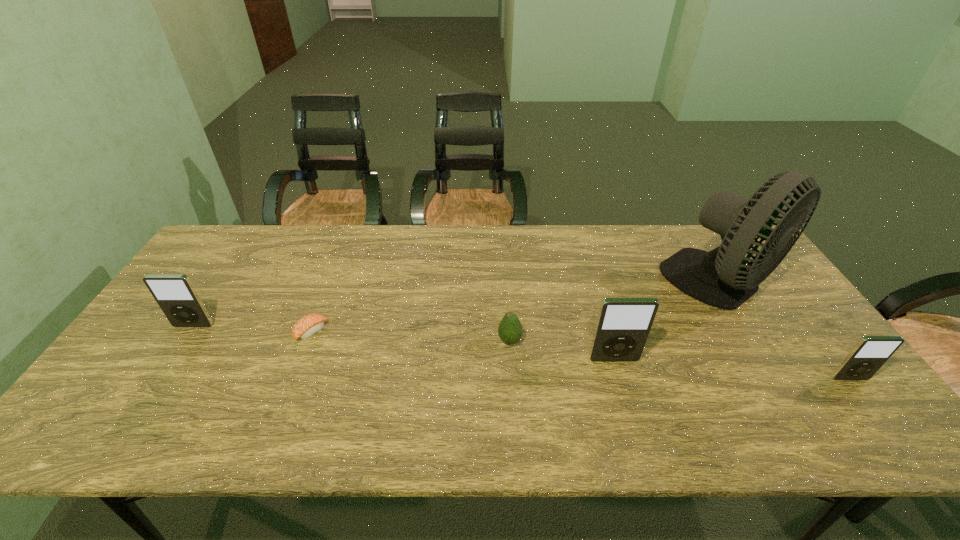
This screenshot has height=540, width=960. Identify the location of the fifth object from right to left. (310, 324).

The height and width of the screenshot is (540, 960). I want to click on vacant space located 0.230m on the front-facing side of the leftmost object, so click(x=144, y=401).

The width and height of the screenshot is (960, 540). Identify the location of free space located on the front-facing side of the fifth farthest object. (626, 404).

Identify the location of free space located on the front of the avocado. The height and width of the screenshot is (540, 960). (512, 369).

Where is `free space located 0.220m in front of the fan to direct airflow`? free space located 0.220m in front of the fan to direct airflow is located at coordinates (789, 394).

The image size is (960, 540). In order to click on vacant space situated 0.240m on the right of the sushi in this screenshot , I will do `click(415, 332)`.

The width and height of the screenshot is (960, 540). Identify the location of object present at the far edge. (720, 278).

You are a GUI agent. You are given a task and a screenshot of the screen. Output one action in this format:
    pyautogui.click(x=<x>, y=<y>)
    Task: Click on the object positioned at the near edge
    The width and height of the screenshot is (960, 540).
    Given the screenshot: What is the action you would take?
    pyautogui.click(x=870, y=353)

Locate an element on the screen. The height and width of the screenshot is (540, 960). object that is at the left edge is located at coordinates (175, 294).

The image size is (960, 540). I want to click on iPod located at the right edge, so click(870, 353).